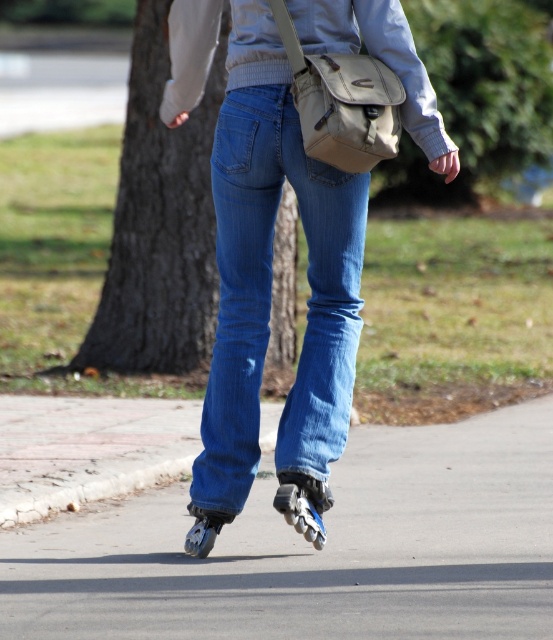
Is smooth concrete at center shorter than light gray fleece sweatshirt at upper center?

Correct, smooth concrete at center is not as tall as light gray fleece sweatshirt at upper center.

Can you confirm if smooth concrete at center is taller than light gray fleece sweatshirt at upper center?

In fact, smooth concrete at center may be shorter than light gray fleece sweatshirt at upper center.

What do you see at coordinates (316, 552) in the screenshot? I see `smooth concrete at center` at bounding box center [316, 552].

Locate an element on the screen. The height and width of the screenshot is (640, 553). smooth concrete at center is located at coordinates (316, 552).

Is light gray fleece sweatshirt at upper center shorter than black rubber roller skate at center?

No.

Identify the location of light gray fleece sweatshirt at upper center. The width and height of the screenshot is (553, 640). (378, 58).

Is point (315, 8) behind point (294, 474)?

No, it is in front of (294, 474).

Locate an element on the screen. light gray fleece sweatshirt at upper center is located at coordinates (378, 58).

Is point (273, 596) closer to viewer compared to point (304, 432)?

Yes, it is in front of point (304, 432).

Who is more distant from viewer, (106,541) or (311,419)?

Point (106,541)

The height and width of the screenshot is (640, 553). I want to click on smooth concrete at center, so click(316, 552).